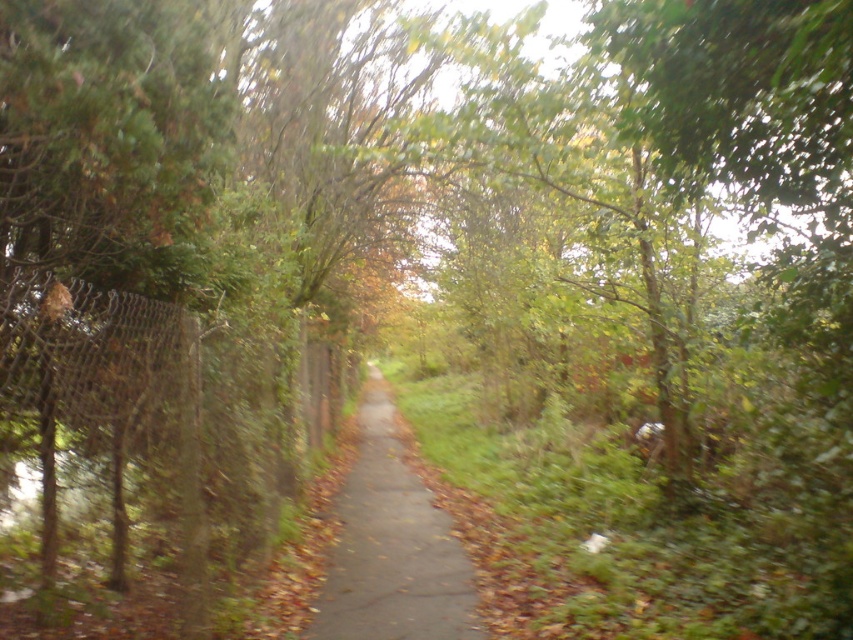
Question: Can you confirm if rusty chain-link fence at left is positioned to the right of gray concrete pavement at center?

Choices:
 (A) yes
 (B) no

Answer: (B)

Question: Does rusty chain-link fence at left have a smaller size compared to gray concrete pavement at center?

Choices:
 (A) yes
 (B) no

Answer: (B)

Question: Is rusty chain-link fence at left below gray concrete pavement at center?

Choices:
 (A) yes
 (B) no

Answer: (B)

Question: Which object is farther from the camera taking this photo?

Choices:
 (A) gray concrete pavement at center
 (B) rusty chain-link fence at left

Answer: (A)

Question: Which point appears closest to the camera in this image?

Choices:
 (A) (422, 596)
 (B) (16, 392)

Answer: (B)

Question: Which point appears closest to the camera in this image?

Choices:
 (A) (86, 296)
 (B) (436, 556)

Answer: (A)